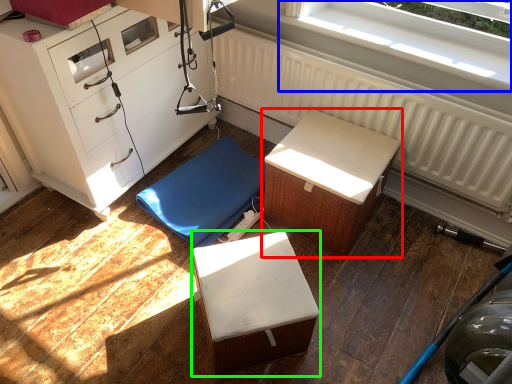
Question: Which object is the closest to the furniture (highlighted by a red box)? Choose among these: window (highlighted by a blue box) or furniture (highlighted by a green box).

Choices:
 (A) window
 (B) furniture

Answer: (B)